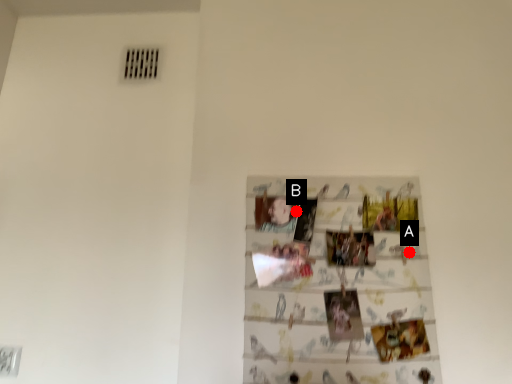
Question: Two points are circled on the image, labeled by A and B beside each circle. Which point is farther from the camera taking this photo?

Choices:
 (A) A is further
 (B) B is further

Answer: (B)